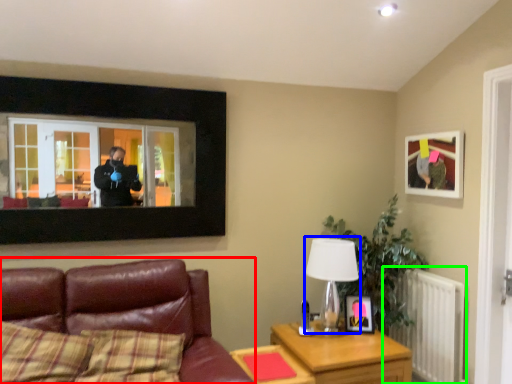
Question: Based on their relative distances, which object is nearer to studio couch (highlighted by a red box)? Choose from table lamp (highlighted by a blue box) and radiator (highlighted by a green box).

Choices:
 (A) table lamp
 (B) radiator

Answer: (A)